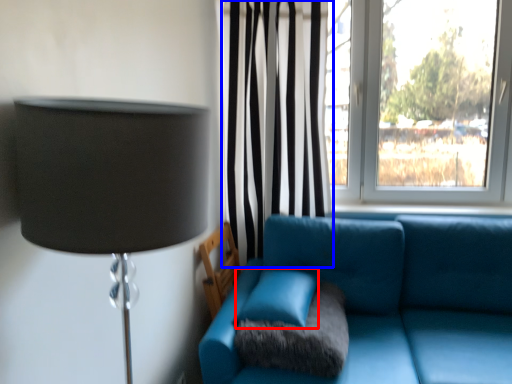
Question: Which point is closer to the camera, turquoise (highlighted by a red box) or curtain (highlighted by a blue box)?

Choices:
 (A) turquoise
 (B) curtain

Answer: (A)